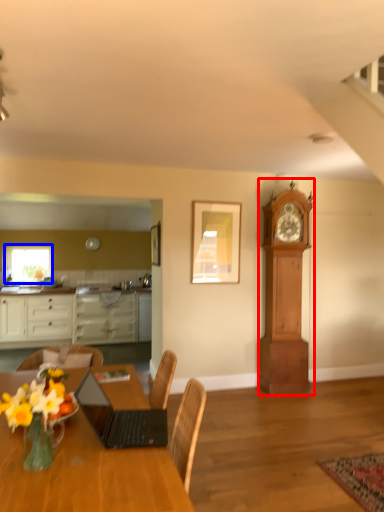
Question: Among these objects, which one is nearest to the camera, clock (highlighted by a red box) or window (highlighted by a blue box)?

Choices:
 (A) clock
 (B) window

Answer: (A)